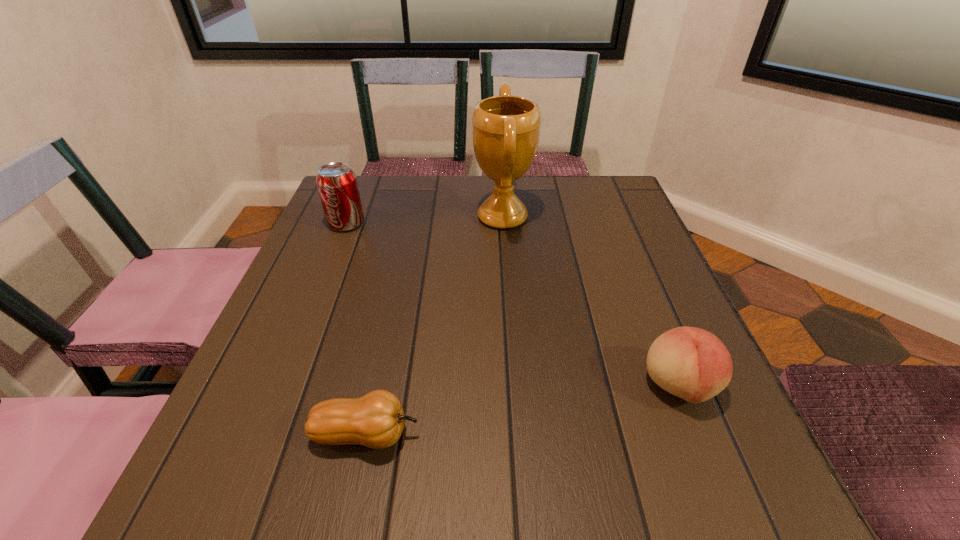
Locate an element on the screen. The height and width of the screenshot is (540, 960). the third object from left to right is located at coordinates click(x=506, y=129).

Locate an element on the screen. the tallest object is located at coordinates (506, 129).

Find the location of `soda can`. soda can is located at coordinates (337, 185).

I want to click on the leftmost object, so click(337, 185).

Find the location of a particular element. This screenshot has height=540, width=960. the third tallest object is located at coordinates (691, 363).

Locate an element on the screen. the rightmost object is located at coordinates (691, 363).

Where is `the second object from left to right`? the second object from left to right is located at coordinates (376, 420).

In order to click on the shortest object in this screenshot , I will do `click(376, 420)`.

At what (x,y) coordinates should I click in order to perform the action: click on free space located on the front of the third object from left to right with the decoration. Please return your answer as a coordinate pair (x, y). This screenshot has height=540, width=960. Looking at the image, I should click on (405, 217).

Locate an element on the screen. Image resolution: width=960 pixels, height=540 pixels. vacant space located 0.300m on the front of the third object from left to right with the decoration is located at coordinates (353, 217).